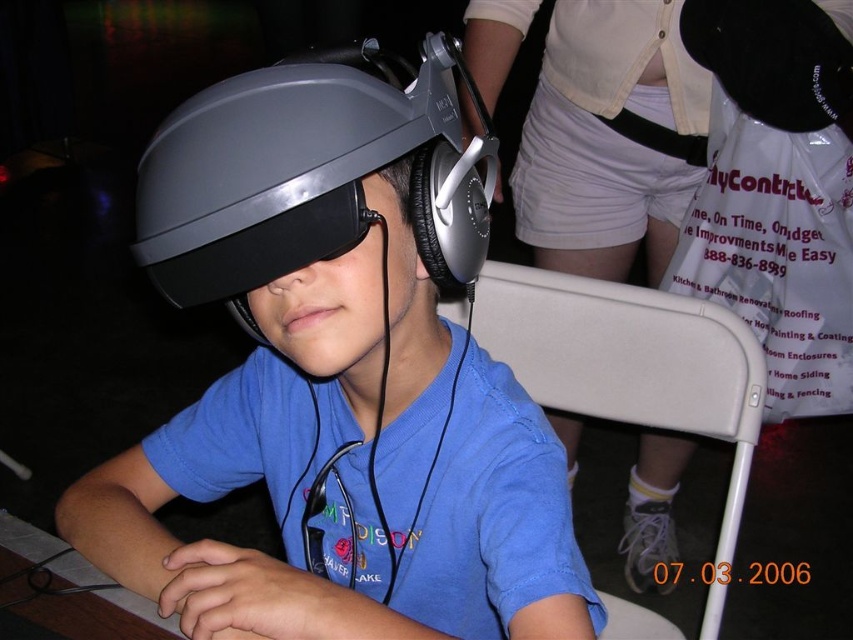
You are setting up a VR station and need to place a controller on the table in front of the matte black headset at center. Based on the coordinates provided in the description, where should you place the controller relative to the headset?

The matte black headset at center is located at point (x=337, y=380), so you should place the controller directly in front of it at the same x and y coordinates but slightly lower on the z axis to ensure proper positioning.